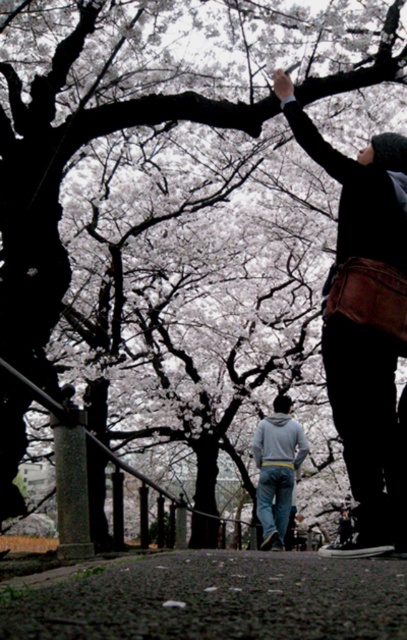
You are standing on the pathway in the cherry blossom scene. There are two points marked on the path. One is at coordinates point (137, 580) and the other is at point (372, 529). If you want to walk towards the point that is closer to you, which coordinate should you head towards?

You should head towards point (137, 580) because it is closer to the viewer than point (372, 529).

You are standing at the entrance of the cherry blossom pathway and want to walk towards the dark asphalt path at lower center. According to the coordinates given, in which direction should you move relative to your current position?

The dark asphalt path at lower center is located at coordinates point (209,596). Since the x coordinate is 0.934, which is closer to the right edge of the image, you should move towards the right direction to reach the dark asphalt path at lower center.

You are standing on the pathway in the cherry blossom scene. There are two points marked on the path, one at coordinates point (277, 80) and the other at point (280, 481). Which point is closer to you?

Point (277, 80) is closer to the viewer than point (280, 481).